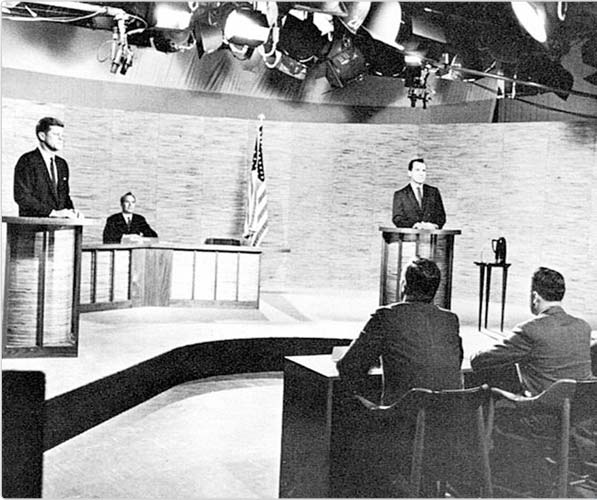
The height and width of the screenshot is (500, 597). What are the coordinates of `chair` in the screenshot? It's located at (220, 239), (439, 404), (574, 395).